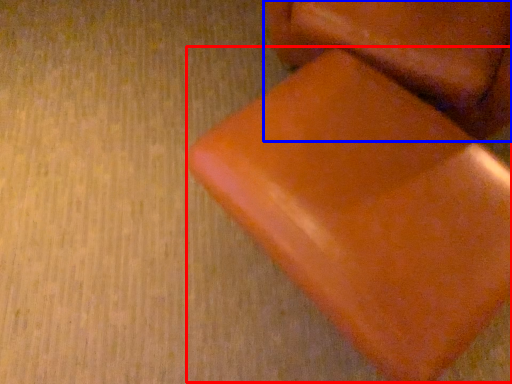
Question: Which point is closer to the camera, bean bag chair (highlighted by a red box) or furniture (highlighted by a blue box)?

Choices:
 (A) bean bag chair
 (B) furniture

Answer: (A)